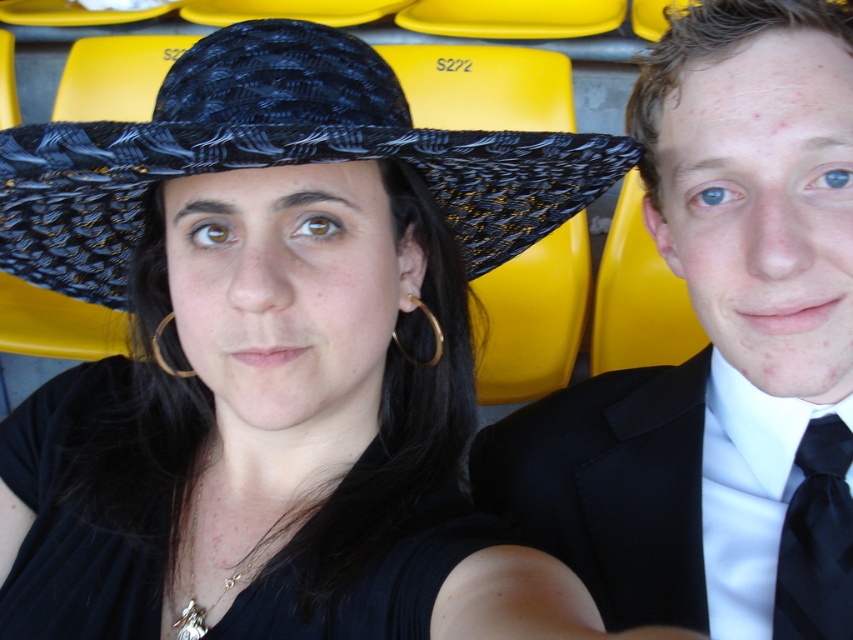
Question: Estimate the real-world distances between objects in this image. Which object is farther from the black silk tie at right?

Choices:
 (A) matte black suit at center
 (B) black woven hat at center
 (C) black matte dress at center

Answer: (B)

Question: Estimate the real-world distances between objects in this image. Which object is farther from the black silk tie at right?

Choices:
 (A) black woven hat at center
 (B) matte black suit at center
 (C) black matte dress at center

Answer: (A)

Question: Which of the following is the farthest from the observer?

Choices:
 (A) black silk tie at right
 (B) matte black suit at center

Answer: (A)

Question: Is matte black suit at center above black woven hat at center?

Choices:
 (A) no
 (B) yes

Answer: (A)

Question: Can you confirm if black woven hat at center is smaller than black silk tie at right?

Choices:
 (A) yes
 (B) no

Answer: (B)

Question: Does matte black suit at center have a greater width compared to black woven hat at center?

Choices:
 (A) no
 (B) yes

Answer: (A)